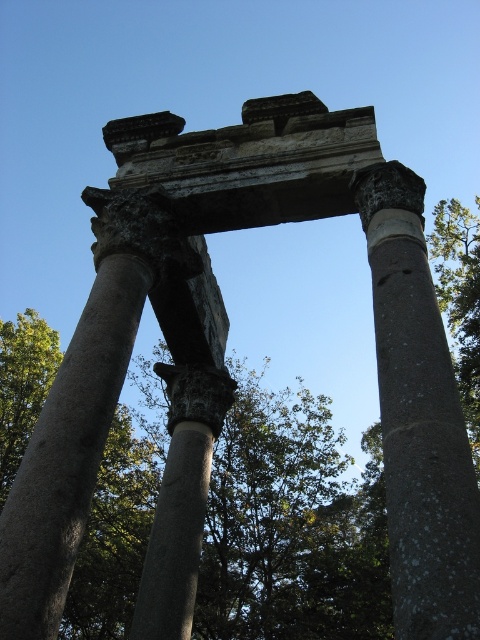
You are standing in front of the ancient stone structure and want to determine which of the two points, point (208, 582) or point (374, 268), is closer to you. Which point is nearer?

Point (208, 582) is further to the viewer than point (374, 268), so point (374, 268) is closer to you.

You are an archaeologist examining the ancient stone structure. You notice a green leafy tree at center and a speckled stone column at center. Which object is closer to you from your viewpoint?

The green leafy tree at center is closer to you because the speckled stone column at center is positioned behind it.

You are a park ranger planning to install a new bench between the green leafy tree at center and the speckled stone column at center. The bench requires 2 meters of space to be placed comfortably. Can you fit the bench between them?

The distance between the green leafy tree at center and the speckled stone column at center is 43.97 meters. Since the bench only needs 2 meters of space, there is more than enough room to place it between them.